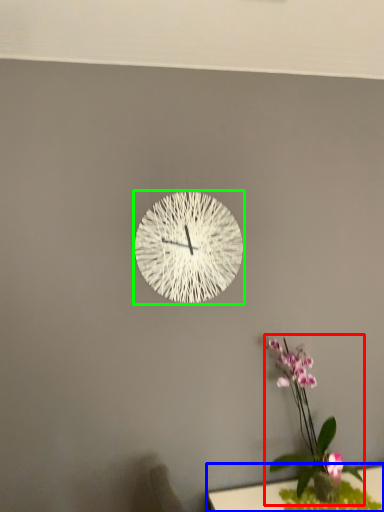
Question: Considering the real-world distances, which object is closest to floral arrangement (highlighted by a red box)? table (highlighted by a blue box) or wall clock (highlighted by a green box).

Choices:
 (A) table
 (B) wall clock

Answer: (A)